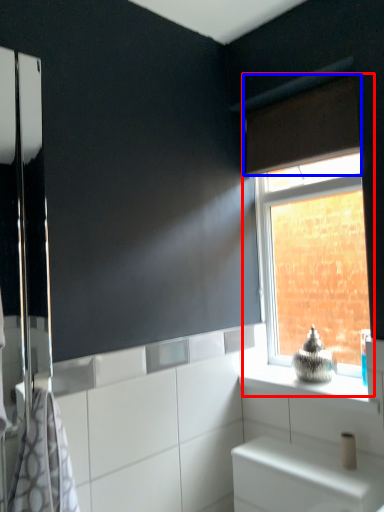
Question: Among these objects, which one is nearest to the camera, window (highlighted by a red box) or curtain (highlighted by a blue box)?

Choices:
 (A) window
 (B) curtain

Answer: (B)